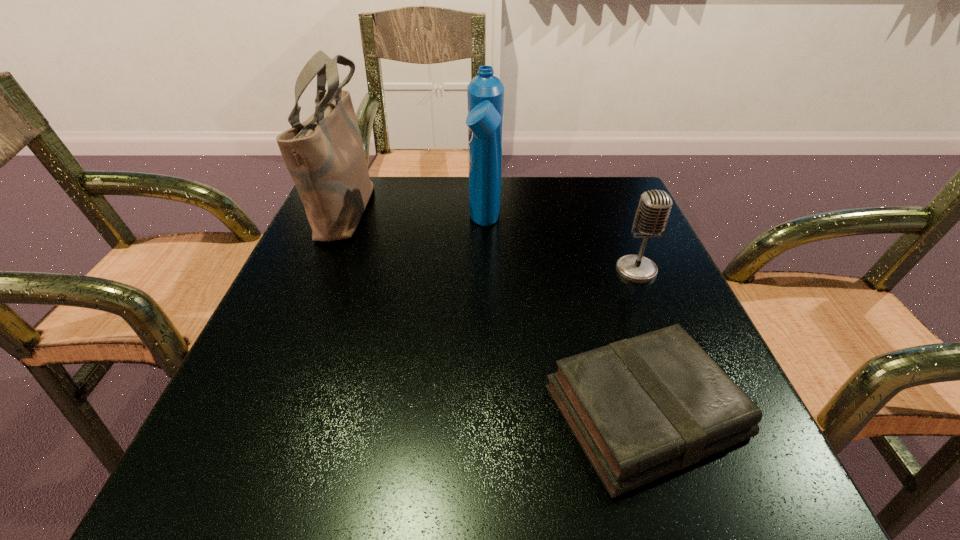
The width and height of the screenshot is (960, 540). I want to click on free space at the left edge, so [356, 254].

This screenshot has height=540, width=960. I want to click on vacant space at the far left corner of the desktop, so click(369, 219).

I want to click on vacant region at the near left corner of the desktop, so click(238, 485).

In the image, there is a desktop. Where is `vacant space at the far right corner`? This screenshot has height=540, width=960. vacant space at the far right corner is located at coordinates coord(634,218).

This screenshot has height=540, width=960. What are the coordinates of `vacant point at the near right corner` in the screenshot? It's located at (718, 472).

Image resolution: width=960 pixels, height=540 pixels. I want to click on free point between the shoulder bag and the second object from left to right, so click(416, 216).

Find the location of a particular element. The height and width of the screenshot is (540, 960). vacant space in between the book and the shampoo is located at coordinates (564, 318).

You are a GUI agent. You are given a task and a screenshot of the screen. Output one action in this format:
    pyautogui.click(x=<x>, y=<y>)
    Task: Click on the unoccupied area between the second shortest object and the leftmost object
    The image size is (960, 540).
    Given the screenshot: What is the action you would take?
    pyautogui.click(x=492, y=239)

Where is `free space between the third object from right to left and the shoulder bag`? free space between the third object from right to left and the shoulder bag is located at coordinates (416, 216).

The height and width of the screenshot is (540, 960). I want to click on vacant point located between the shoulder bag and the third object from right to left, so click(x=416, y=216).